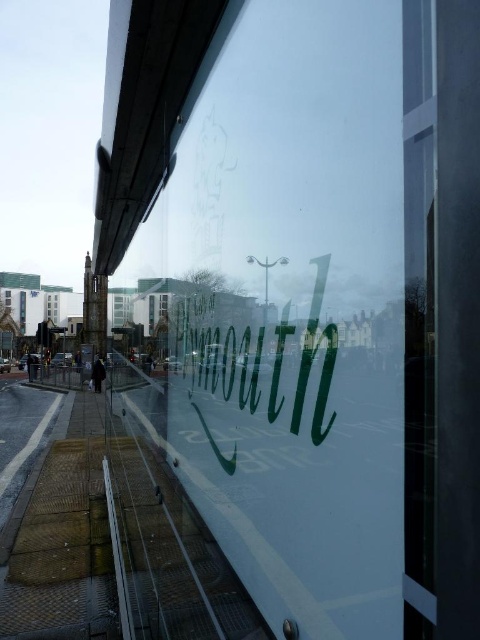
You are an architect inspecting a building facade. You notice two glass windows at the center of the building. The first is labeled as clear glass window at center and the second as transparent glass window at center. Which of these two windows is larger in size?

The clear glass window at center is bigger than the transparent glass window at center according to the description provided.

You are an architect designing a new building and want to install a sign and a window on the facade. The transparent glass sign at center and transparent glass window at center must be placed such that the sign is larger than the window. Based on the scene, which object should be placed where to meet this requirement?

The transparent glass sign at center should be placed where the larger object is needed because it is larger in size than the transparent glass window at center.

You are standing in front of the reflective glass surface and notice two points marked on it. The first point is at coordinates point (139, 164) and the second is at point (159, 305). Which of these two points appears closer to you on the glass surface?

Point (139, 164) is closer to the camera than point (159, 305), so the first point appears closer to you on the glass surface.